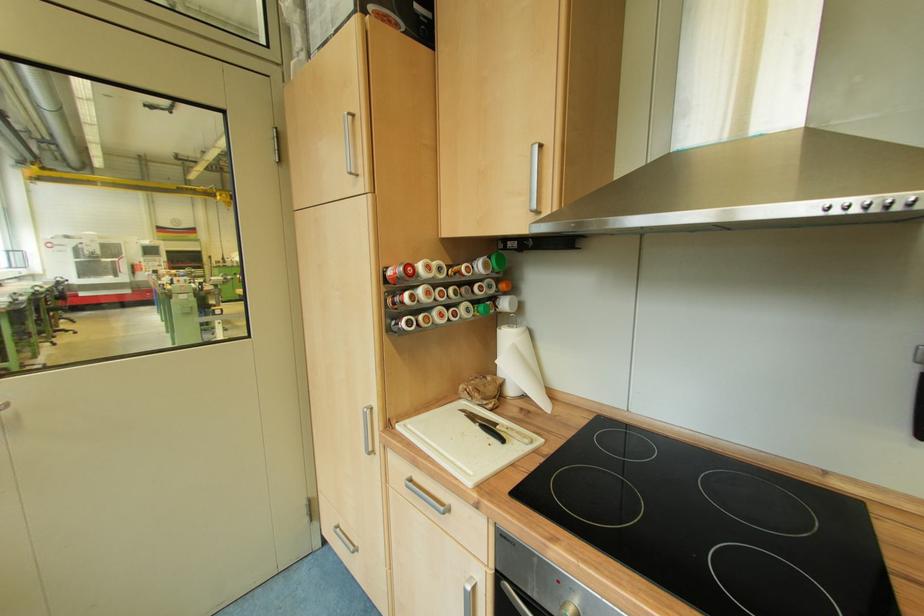
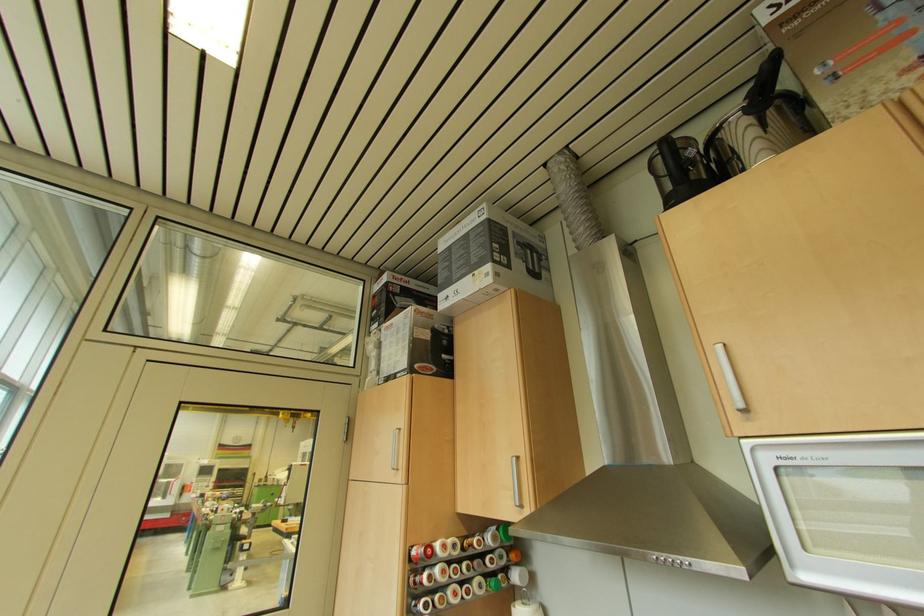
Locate, in the second image, the point that corresponds to (x=454, y=236) in the first image.

(468, 513)